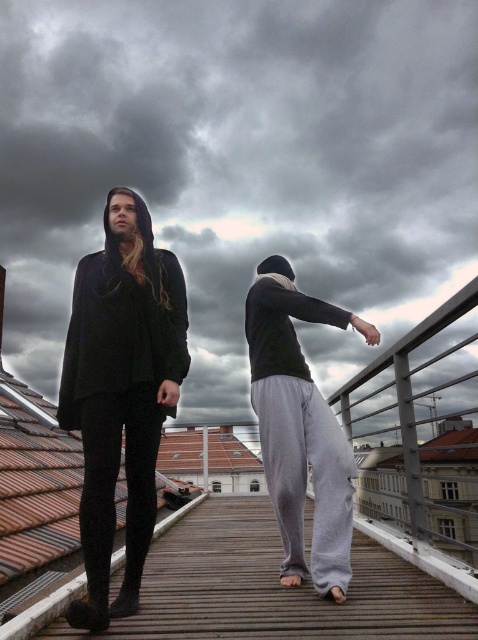
Question: Which point is closer to the camera?

Choices:
 (A) matte black hoodie at center
 (B) gray sweatpants at center

Answer: (A)

Question: Is matte black hoodie at center to the right of gray sweatpants at center from the viewer's perspective?

Choices:
 (A) yes
 (B) no

Answer: (B)

Question: Is matte black cape at left positioned in front of gray sweatpants at center?

Choices:
 (A) yes
 (B) no

Answer: (A)

Question: Can you confirm if matte black cape at left is thinner than gray sweatpants at center?

Choices:
 (A) yes
 (B) no

Answer: (A)

Question: Which of the following is the closest to the observer?

Choices:
 (A) (296, 548)
 (B) (84, 410)
 (C) (126, 426)

Answer: (B)

Question: Which point is closer to the camera?

Choices:
 (A) gray sweatpants at center
 (B) matte black cape at left

Answer: (B)